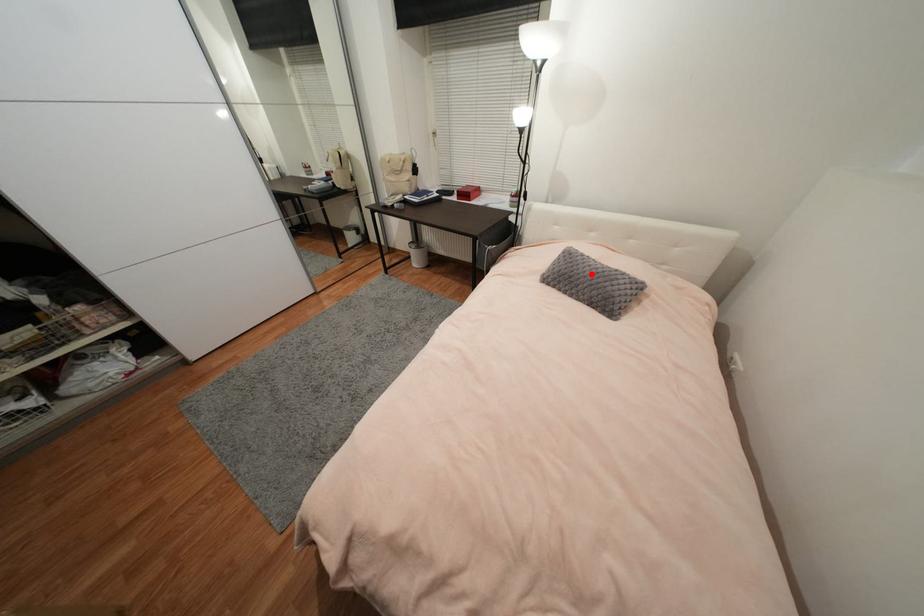
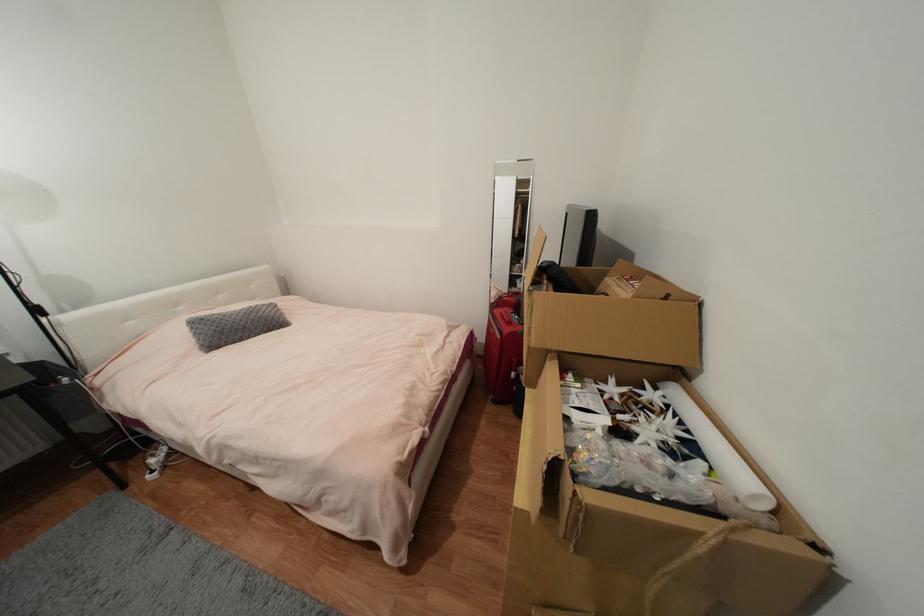
The point at the highlighted location is marked in the first image. Where is the corresponding point in the second image?

(244, 320)